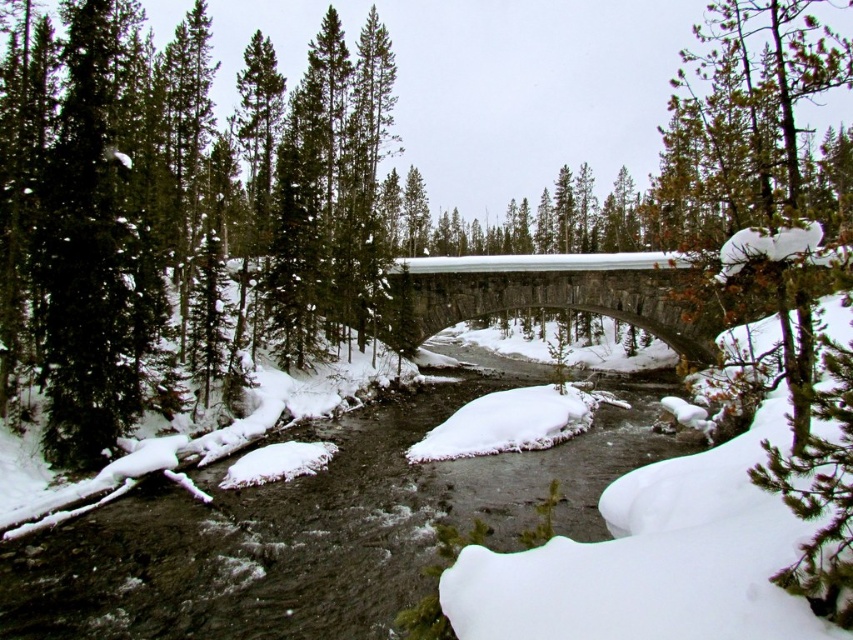
You are a hiker who wants to take a photo of the gray stone bridge at center. However, the green matte tree at left might block your view. Based on their heights, will the tree obscure the bridge in your photo?

The green matte tree at left is much taller than the gray stone bridge at center, so it might block the view of the bridge in your photo.

You are standing at the center of the snow covered bridge and want to locate the green matte tree at left. In which direction should you look to see it?

The green matte tree at left is located at the left side of the scene, so you should look to your left to see it.

You are standing on the gray stone bridge at center and want to walk to the green matte tree at left. Which direction should you face to walk towards it?

You should face to the left to walk towards the green matte tree at left since it is located to the left of the gray stone bridge at center.